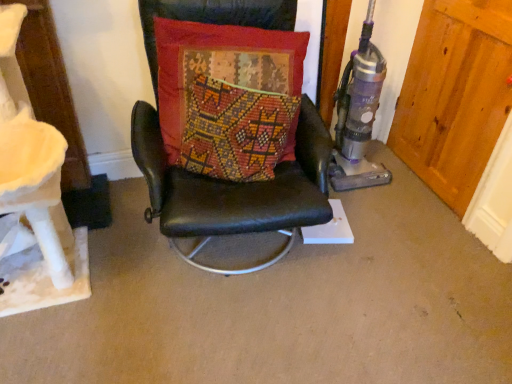
Question: Can you confirm if wooden door at right is positioned to the right of textured red cushion at center?

Choices:
 (A) yes
 (B) no

Answer: (A)

Question: From the image's perspective, is wooden door at right below textured red cushion at center?

Choices:
 (A) yes
 (B) no

Answer: (B)

Question: From the image's perspective, is wooden door at right located above textured red cushion at center?

Choices:
 (A) no
 (B) yes

Answer: (B)

Question: Considering the relative positions of wooden door at right and textured red cushion at center in the image provided, is wooden door at right in front of textured red cushion at center?

Choices:
 (A) yes
 (B) no

Answer: (B)

Question: Can you confirm if wooden door at right is thinner than textured red cushion at center?

Choices:
 (A) no
 (B) yes

Answer: (B)

Question: Is wooden door at right oriented towards textured red cushion at center?

Choices:
 (A) yes
 (B) no

Answer: (A)

Question: Is wooden door at right further to camera compared to black leather chair at center?

Choices:
 (A) yes
 (B) no

Answer: (A)

Question: Considering the relative positions of wooden door at right and black leather chair at center in the image provided, is wooden door at right to the right of black leather chair at center from the viewer's perspective?

Choices:
 (A) no
 (B) yes

Answer: (B)

Question: Does wooden door at right turn towards black leather chair at center?

Choices:
 (A) no
 (B) yes

Answer: (B)

Question: Is wooden door at right outside black leather chair at center?

Choices:
 (A) no
 (B) yes

Answer: (B)

Question: Are wooden door at right and black leather chair at center located far from each other?

Choices:
 (A) no
 (B) yes

Answer: (A)

Question: Can you confirm if wooden door at right is wider than black leather chair at center?

Choices:
 (A) yes
 (B) no

Answer: (B)

Question: From the image's perspective, is textured red cushion at center over wooden door at right?

Choices:
 (A) no
 (B) yes

Answer: (A)